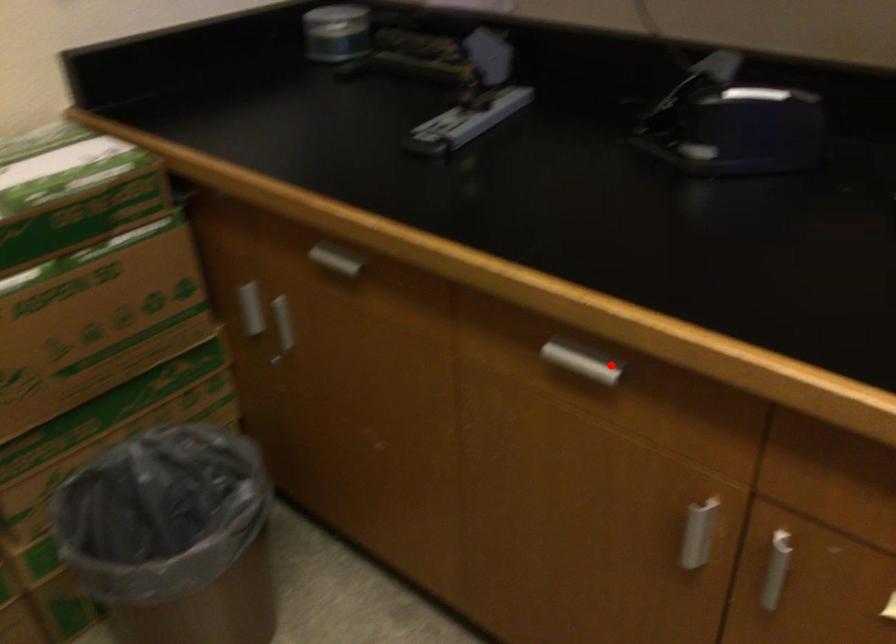
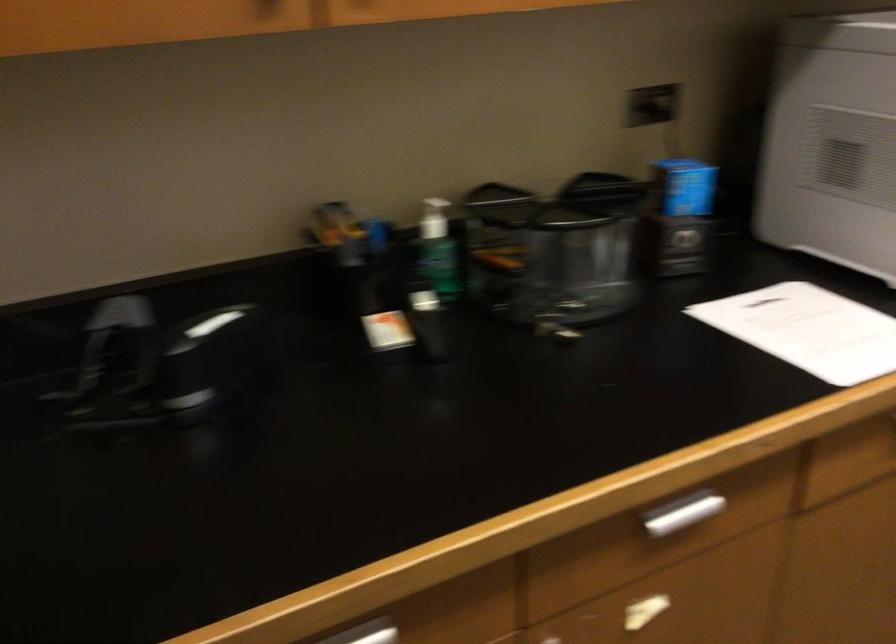
In the second image, find the point that corresponds to the highlighted location in the first image.

(369, 630)